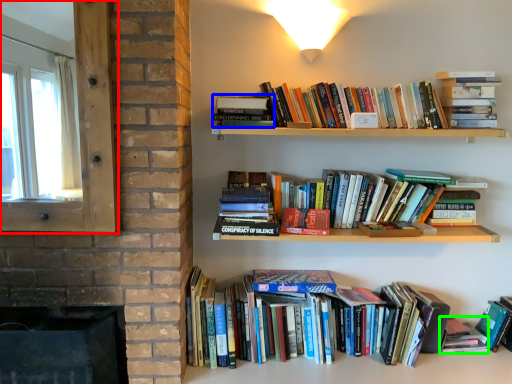
Question: Which object is the farthest from window screen (highlighted by a red box)? Choose among these: book (highlighted by a blue box) or paperback book (highlighted by a green box).

Choices:
 (A) book
 (B) paperback book

Answer: (B)